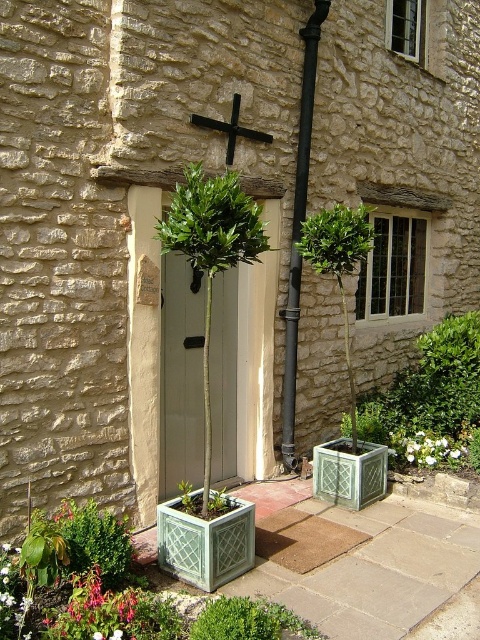
From the picture: You are standing at the entrance of the cottage and want to enter the white wooden door. There is a black metal pipe at center and a green lattice planter at lower right in your way. Which object is closer to you as you approach the door?

The green lattice planter at lower right is closer to you because the black metal pipe at center is behind it.

You are a painter who needs to decide which object to paint first. The white matte door at center and the green lattice planter at lower right are both in your view. Which object is narrower so you can finish painting it faster?

The white matte door at center has a lesser width compared to green lattice planter at lower right, so it is narrower and can be painted faster.

You are standing in front of the cottage entrance and want to know which point is closer to you. Can you determine which of the two points, point (475, 454) or point (302, 100), is closer to your current position?

Point (302, 100) is closer to you than point (475, 454) because the description states that point (475, 454) is further to the camera than point (302, 100).